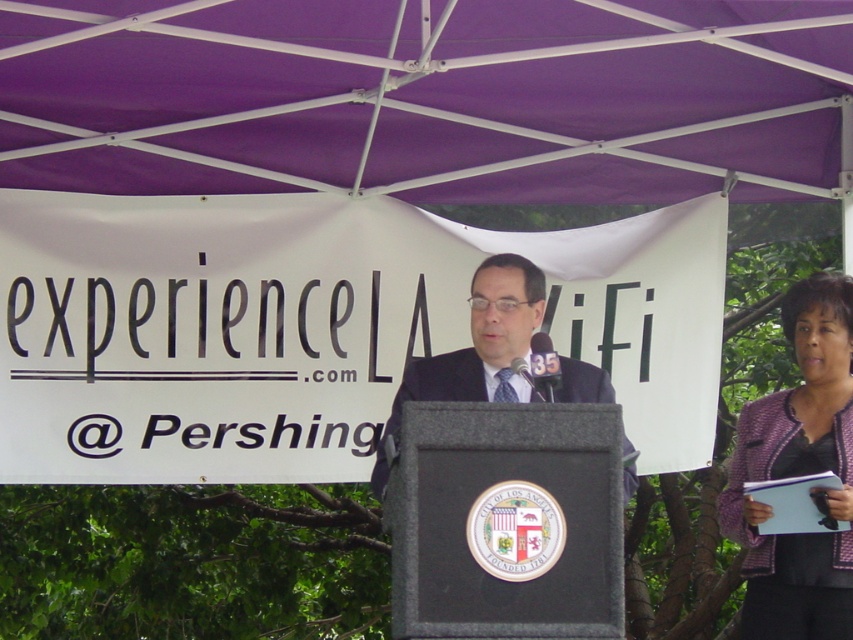
Consider the image. You are organizing a charity event and need to decide which attire is more suitable for a volunteer role. Considering the purple tweed blazer at lower right and the dark blue suit at center, which one is more likely to be a volunteer uniform based on their sizes?

The purple tweed blazer at lower right has a smaller size compared to the dark blue suit at center. Since volunteer uniforms typically prioritize comfort and practicality, the smaller purple tweed blazer at lower right might be more suitable for volunteer roles that require mobility and flexibility.

In the scene shown: You are an event planner checking the setup for the outdoor event. You need to ensure that the purple fabric canopy at upper center can provide shade for the purple tweed blazer at lower right. Based on their heights, can the canopy cover the blazer?

The purple fabric canopy at upper center is not as tall as the purple tweed blazer at lower right, so the canopy cannot provide sufficient shade for the blazer since it is shorter in height.